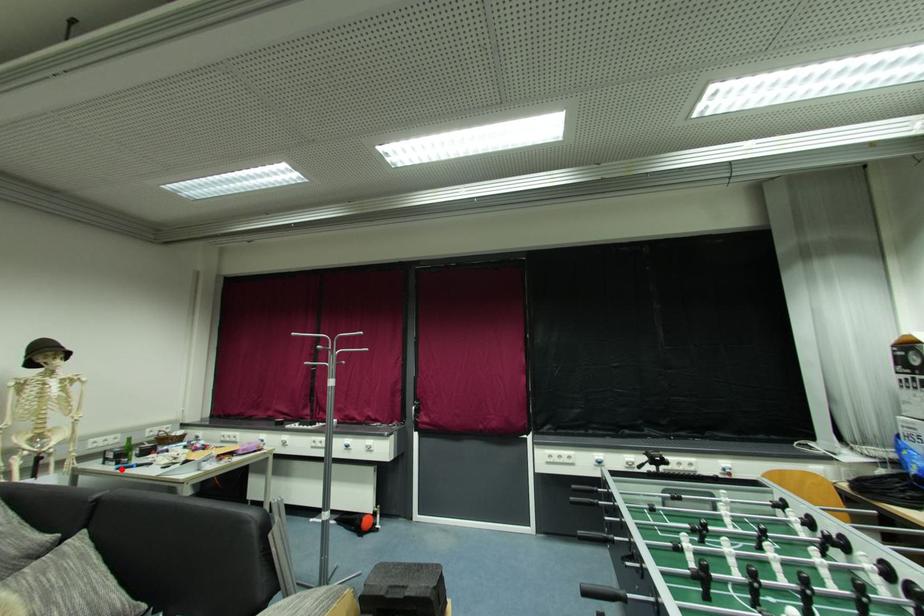
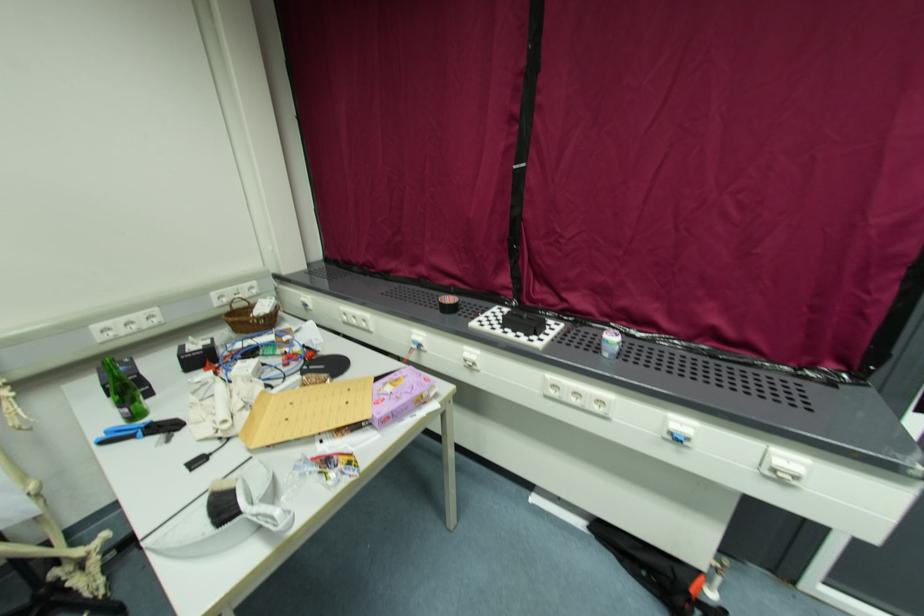
Question: I am providing you with two images of the same scene from different viewpoints. In image1, a red point is highlighted. Considering the same 3D point in image2, which of the following is correct?

Choices:
 (A) It is closer
 (B) It is farther

Answer: (A)